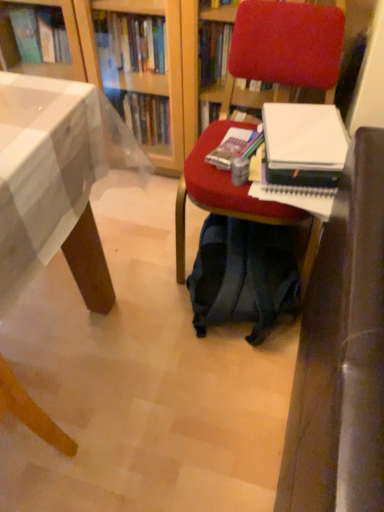
Question: In the image, is velvet red chair at center positioned in front of or behind wooden desk at lower left?

Choices:
 (A) front
 (B) behind

Answer: (B)

Question: Would you say velvet red chair at center is inside or outside wooden desk at lower left?

Choices:
 (A) outside
 (B) inside

Answer: (A)

Question: Estimate the real-world distances between objects in this image. Which object is farther from the white paper at center right?

Choices:
 (A) wooden desk at lower left
 (B) velvet red chair at center
 (C) dark blue fabric backpack at center

Answer: (A)

Question: Estimate the real-world distances between objects in this image. Which object is closer to the dark blue fabric backpack at center?

Choices:
 (A) velvet red chair at center
 (B) wooden desk at lower left
 (C) white paper at center right

Answer: (A)